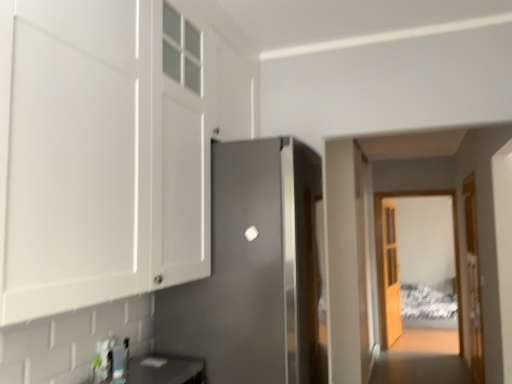
Question: Does wooden door at right, which appears as the 2th door when viewed from the back, have a smaller size compared to satin silver refrigerator at center, which is the 1th door from front to back?

Choices:
 (A) yes
 (B) no

Answer: (A)

Question: Are wooden door at right, the 2th door when ordered from front to back, and satin silver refrigerator at center, positioned as the 1th door in left-to-right order, far apart?

Choices:
 (A) yes
 (B) no

Answer: (A)

Question: From the image's perspective, is wooden door at right, which is the first door in right-to-left order, over satin silver refrigerator at center, positioned as the 1th door in left-to-right order?

Choices:
 (A) no
 (B) yes

Answer: (A)

Question: Considering the relative sizes of wooden door at right, which appears as the 2th door when viewed from the back, and satin silver refrigerator at center, which is the 1th door from front to back, in the image provided, is wooden door at right, which appears as the 2th door when viewed from the back, wider than satin silver refrigerator at center, which is the 1th door from front to back,?

Choices:
 (A) yes
 (B) no

Answer: (B)

Question: From the image's perspective, is wooden door at right, which appears as the 2th door when viewed from the back, located beneath satin silver refrigerator at center, the 3th door positioned from the back?

Choices:
 (A) no
 (B) yes

Answer: (B)

Question: Does wooden door at right, which appears as the third door when viewed from the left, have a lesser height compared to satin silver refrigerator at center, which is counted as the 3th door, starting from the right?

Choices:
 (A) yes
 (B) no

Answer: (B)

Question: Considering the relative sizes of satin silver refrigerator at center, positioned as the 1th door in left-to-right order, and clear glass door at center in the image provided, is satin silver refrigerator at center, positioned as the 1th door in left-to-right order, taller than clear glass door at center?

Choices:
 (A) no
 (B) yes

Answer: (A)

Question: Is satin silver refrigerator at center, which is the 1th door from front to back, at the left side of clear glass door at center?

Choices:
 (A) yes
 (B) no

Answer: (A)

Question: Does satin silver refrigerator at center, which is counted as the 3th door, starting from the right, have a lesser width compared to clear glass door at center?

Choices:
 (A) no
 (B) yes

Answer: (A)

Question: From the image's perspective, does satin silver refrigerator at center, which is counted as the 3th door, starting from the right, appear lower than clear glass door at center?

Choices:
 (A) no
 (B) yes

Answer: (A)

Question: Is satin silver refrigerator at center, which is counted as the 3th door, starting from the right, positioned with its back to clear glass door at center?

Choices:
 (A) no
 (B) yes

Answer: (A)

Question: From a real-world perspective, does satin silver refrigerator at center, the 3th door positioned from the back, stand above clear glass door at center?

Choices:
 (A) no
 (B) yes

Answer: (B)

Question: Considering the relative sizes of wooden door at right, which appears as the third door when viewed from the left, and white glossy cabinet at upper left in the image provided, is wooden door at right, which appears as the third door when viewed from the left, thinner than white glossy cabinet at upper left?

Choices:
 (A) yes
 (B) no

Answer: (A)